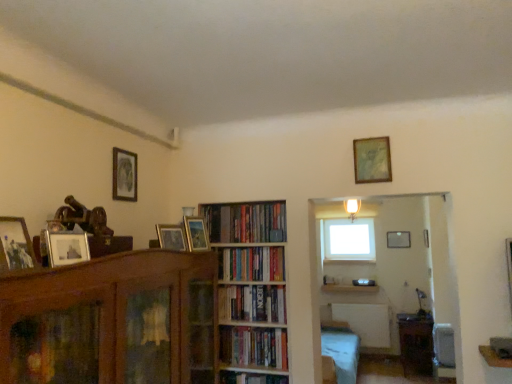
Question: Is wooden picture frame at center, which is the 4th picture frame in front-to-back order, closer to the viewer compared to hardcover books at center, which appears as the third book when viewed from the top?

Choices:
 (A) yes
 (B) no

Answer: (A)

Question: Can you confirm if wooden picture frame at center, acting as the 4th picture frame starting from the left, is smaller than hardcover books at center, the 2th book from the bottom?

Choices:
 (A) yes
 (B) no

Answer: (A)

Question: Does wooden picture frame at center, which ranks as the fourth picture frame in top-to-bottom order, have a lesser height compared to hardcover books at center, the 2th book from the bottom?

Choices:
 (A) yes
 (B) no

Answer: (A)

Question: From the image's perspective, is wooden picture frame at center, arranged as the third picture frame when viewed from the right, located beneath hardcover books at center, the 2th book from the bottom?

Choices:
 (A) yes
 (B) no

Answer: (B)

Question: From a real-world perspective, is wooden picture frame at center, which ranks as the fourth picture frame in top-to-bottom order, positioned under hardcover books at center, the 2th book from the bottom, based on gravity?

Choices:
 (A) no
 (B) yes

Answer: (A)

Question: Can you confirm if wooden picture frame at center, acting as the 4th picture frame starting from the left, is positioned to the left of hardcover books at center, which appears as the third book when viewed from the top?

Choices:
 (A) yes
 (B) no

Answer: (A)

Question: From the image's perspective, is matte gold picture frame at upper center, the 6th picture frame in the left-to-right sequence, located beneath wooden table at lower right?

Choices:
 (A) yes
 (B) no

Answer: (B)

Question: Does matte gold picture frame at upper center, the 6th picture frame in the left-to-right sequence, have a greater height compared to wooden table at lower right?

Choices:
 (A) no
 (B) yes

Answer: (A)

Question: Is the surface of matte gold picture frame at upper center, which is counted as the 1th picture frame, starting from the bottom, in direct contact with wooden table at lower right?

Choices:
 (A) no
 (B) yes

Answer: (A)

Question: Is matte gold picture frame at upper center, the 6th picture frame in the left-to-right sequence, oriented towards wooden table at lower right?

Choices:
 (A) no
 (B) yes

Answer: (A)

Question: Is matte gold picture frame at upper center, the 6th picture frame in the left-to-right sequence, far from wooden table at lower right?

Choices:
 (A) yes
 (B) no

Answer: (A)

Question: Is matte gold picture frame at upper center, which ranks as the 6th picture frame in top-to-bottom order, bigger than wooden table at lower right?

Choices:
 (A) yes
 (B) no

Answer: (B)

Question: Are wooden picture frame at center, acting as the 4th picture frame starting from the left, and wooden table at lower right making contact?

Choices:
 (A) yes
 (B) no

Answer: (B)